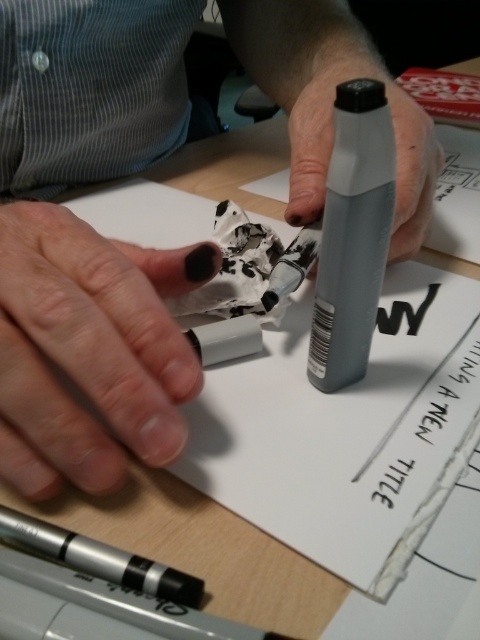
You are an artist trying to choose between the matte plastic marker at center and the black matte pen at center for a detailed drawing. Which one would you pick if you want the tool that is wider?

The matte plastic marker at center has a greater width than the black matte pen at center, so it is the better choice for a detailed drawing requiring a wider tool.

In the scene shown: You are a photographer trying to capture a close shot of the hands and the paper. You notice two points on the desk at coordinates point (167,339) and point (411,220). Which point should you focus on to ensure the hands and the paper are in sharp focus?

You should focus on point (167,339) because it is closer to the camera than point (411,220). This will ensure the hands and the paper are in sharp focus.

You are an artist who needs to choose a marker for a detailed drawing. You have two options on the desk, the matte plastic marker at center and the matte gray marker at center. Which one would you choose if you want a larger marker?

The matte plastic marker at center is larger in size than the matte gray marker at center, so you should choose the matte plastic marker at center for a detailed drawing.